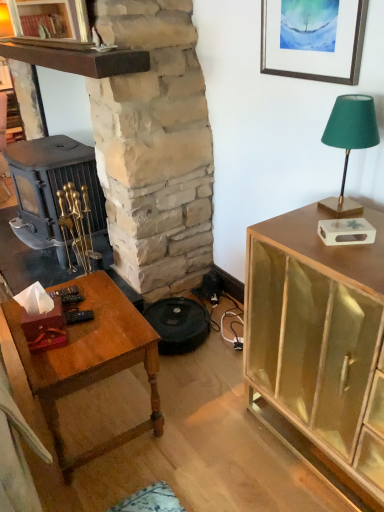
Question: Considering the relative sizes of stone fireplace at center and wooden table at lower left in the image provided, is stone fireplace at center shorter than wooden table at lower left?

Choices:
 (A) no
 (B) yes

Answer: (A)

Question: Is stone fireplace at center at the left side of wooden table at lower left?

Choices:
 (A) yes
 (B) no

Answer: (A)

Question: Is stone fireplace at center taller than wooden table at lower left?

Choices:
 (A) no
 (B) yes

Answer: (B)

Question: From a real-world perspective, is stone fireplace at center located beneath wooden table at lower left?

Choices:
 (A) yes
 (B) no

Answer: (B)

Question: Does stone fireplace at center have a lesser width compared to wooden table at lower left?

Choices:
 (A) no
 (B) yes

Answer: (A)

Question: From the image's perspective, is silver metallic picture frame at upper right located above or below stone fireplace at center?

Choices:
 (A) below
 (B) above

Answer: (B)

Question: Relative to stone fireplace at center, is silver metallic picture frame at upper right in front or behind?

Choices:
 (A) front
 (B) behind

Answer: (B)

Question: Would you say silver metallic picture frame at upper right is to the left or to the right of stone fireplace at center in the picture?

Choices:
 (A) left
 (B) right

Answer: (B)

Question: From a real-world perspective, is silver metallic picture frame at upper right physically located above or below stone fireplace at center?

Choices:
 (A) above
 (B) below

Answer: (A)

Question: In the image, is stone fireplace at center positioned in front of or behind wooden table at lower left?

Choices:
 (A) front
 (B) behind

Answer: (A)

Question: Considering the relative positions of stone fireplace at center and wooden table at lower left in the image provided, is stone fireplace at center to the left or to the right of wooden table at lower left?

Choices:
 (A) left
 (B) right

Answer: (A)

Question: From a real-world perspective, is stone fireplace at center positioned above or below wooden table at lower left?

Choices:
 (A) below
 (B) above

Answer: (B)

Question: Does point (182, 67) appear closer or farther from the camera than point (162, 418)?

Choices:
 (A) farther
 (B) closer

Answer: (A)

Question: Is stone fireplace at center inside the boundaries of green fabric lampshade at upper right, or outside?

Choices:
 (A) inside
 (B) outside

Answer: (B)

Question: Considering the positions of stone fireplace at center and green fabric lampshade at upper right in the image, is stone fireplace at center wider or thinner than green fabric lampshade at upper right?

Choices:
 (A) thin
 (B) wide

Answer: (B)